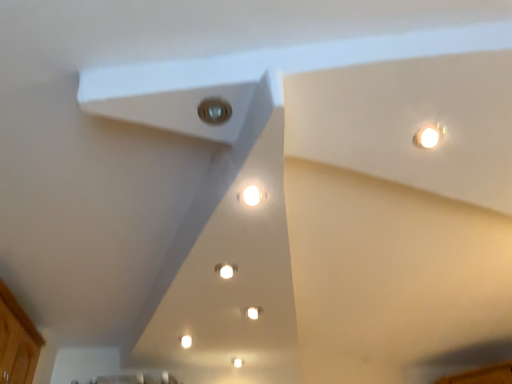
What do you see at coordinates (214, 111) in the screenshot? The image size is (512, 384). I see `matte glass light at center, which is the 2th light in back-to-front order` at bounding box center [214, 111].

This screenshot has width=512, height=384. Describe the element at coordinates (226, 271) in the screenshot. I see `white glossy light at center, placed as the 1th light when sorted from back to front` at that location.

Identify the location of matte glass light at center, which is the 1th light from top to bottom. (214, 111).

Between wooden cabinet at lower left and white glossy light at center, which appears as the first light when ordered from the bottom, which one appears on the left side from the viewer's perspective?

Positioned to the left is wooden cabinet at lower left.

Is the position of wooden cabinet at lower left more distant than that of white glossy light at center, the second light viewed from the top?

No, wooden cabinet at lower left is closer to the viewer.

Where is `the 1st light positioned above the wooden cabinet at lower left (from a real-world perspective)`? the 1st light positioned above the wooden cabinet at lower left (from a real-world perspective) is located at coordinates (226, 271).

Considering the sizes of wooden cabinet at lower left and white glossy light at center, placed as the 1th light when sorted from back to front, in the image, is wooden cabinet at lower left bigger or smaller than white glossy light at center, placed as the 1th light when sorted from back to front,?

wooden cabinet at lower left is bigger than white glossy light at center, placed as the 1th light when sorted from back to front.

Looking at this image, is white glossy light at center, which appears as the first light when ordered from the bottom, at the back of matte glass light at center, which is the 2th light from bottom to top?

That's not correct — matte glass light at center, which is the 2th light from bottom to top, is not looking away from white glossy light at center, which appears as the first light when ordered from the bottom.

Can you confirm if matte glass light at center, which is the 1th light from top to bottom, is wider than white glossy light at center, which appears as the first light when ordered from the bottom?

Correct, the width of matte glass light at center, which is the 1th light from top to bottom, exceeds that of white glossy light at center, which appears as the first light when ordered from the bottom.

How many degrees apart are the facing directions of matte glass light at center, arranged as the first light when viewed from the front, and white glossy light at center, which appears as the first light when ordered from the bottom?

99.3 degrees separate the facing orientations of matte glass light at center, arranged as the first light when viewed from the front, and white glossy light at center, which appears as the first light when ordered from the bottom.

Is the position of matte glass light at center, which is the 1th light from top to bottom, less distant than that of white glossy light at center, placed as the 1th light when sorted from back to front?

Yes, the depth of matte glass light at center, which is the 1th light from top to bottom, is less than that of white glossy light at center, placed as the 1th light when sorted from back to front.

Consider the image. Which object is more forward, wooden cabinet at lower left or matte glass light at center, which is the 2th light from bottom to top?

matte glass light at center, which is the 2th light from bottom to top, is more forward.

From a real-world perspective, between wooden cabinet at lower left and matte glass light at center, arranged as the first light when viewed from the front, who is vertically higher?

In real-world perspective, matte glass light at center, arranged as the first light when viewed from the front, is above.

Considering the sizes of wooden cabinet at lower left and matte glass light at center, which is the 2th light in back-to-front order, in the image, is wooden cabinet at lower left wider or thinner than matte glass light at center, which is the 2th light in back-to-front order,?

wooden cabinet at lower left is wider than matte glass light at center, which is the 2th light in back-to-front order.

From the image's perspective, would you say wooden cabinet at lower left is shown under matte glass light at center, which is the 1th light from top to bottom?

Yes, from the image's perspective, wooden cabinet at lower left is beneath matte glass light at center, which is the 1th light from top to bottom.

From a real-world perspective, relative to wooden cabinet at lower left, is matte glass light at center, which is the 1th light from top to bottom, vertically above or below?

From a real-world perspective, matte glass light at center, which is the 1th light from top to bottom, is physically above wooden cabinet at lower left.

Can we say matte glass light at center, which is the 1th light from top to bottom, lies outside wooden cabinet at lower left?

Yes, matte glass light at center, which is the 1th light from top to bottom, is outside of wooden cabinet at lower left.

Consider the image. Considering the sizes of objects matte glass light at center, which is the 2th light from bottom to top, and wooden cabinet at lower left in the image provided, who is smaller, matte glass light at center, which is the 2th light from bottom to top, or wooden cabinet at lower left?

With smaller size is matte glass light at center, which is the 2th light from bottom to top.

In the scene shown: Which of these two, matte glass light at center, which is the 1th light from top to bottom, or wooden cabinet at lower left, stands shorter?

matte glass light at center, which is the 1th light from top to bottom, is shorter.

Is white glossy light at center, the second light viewed from the top, to the right of wooden cabinet at lower left from the viewer's perspective?

Indeed, white glossy light at center, the second light viewed from the top, is positioned on the right side of wooden cabinet at lower left.

Does white glossy light at center, marked as the second light in a front-to-back arrangement, have a lesser width compared to wooden cabinet at lower left?

Yes, white glossy light at center, marked as the second light in a front-to-back arrangement, is thinner than wooden cabinet at lower left.

Are white glossy light at center, placed as the 1th light when sorted from back to front, and wooden cabinet at lower left located far from each other?

No, white glossy light at center, placed as the 1th light when sorted from back to front, is not far away from wooden cabinet at lower left.

Does point (227, 274) lie in front of point (218, 104)?

No, it is not.

Is white glossy light at center, the second light viewed from the top, wider or thinner than matte glass light at center, which is the 1th light from top to bottom?

Clearly, white glossy light at center, the second light viewed from the top, has less width compared to matte glass light at center, which is the 1th light from top to bottom.

Between white glossy light at center, placed as the 1th light when sorted from back to front, and matte glass light at center, which is the 2th light from bottom to top, which one has more height?

white glossy light at center, placed as the 1th light when sorted from back to front.

From a real-world perspective, which object stands above the other?

From a 3D spatial view, matte glass light at center, which is the 2th light in back-to-front order, is above.

Locate an element on the screen. This screenshot has height=384, width=512. cabinetry directly beneath the white glossy light at center, the second light viewed from the top (from a real-world perspective) is located at coordinates (17, 341).

The height and width of the screenshot is (384, 512). What are the coordinates of `light in front of the white glossy light at center, which appears as the first light when ordered from the bottom` in the screenshot? It's located at (214, 111).

Considering their positions, is white glossy light at center, which appears as the first light when ordered from the bottom, positioned further to matte glass light at center, which is the 2th light from bottom to top, than wooden cabinet at lower left?

wooden cabinet at lower left lies further to matte glass light at center, which is the 2th light from bottom to top, than the other object.

Which object lies nearer to the anchor point wooden cabinet at lower left, white glossy light at center, which appears as the first light when ordered from the bottom, or matte glass light at center, arranged as the first light when viewed from the front?

Among the two, white glossy light at center, which appears as the first light when ordered from the bottom, is located nearer to wooden cabinet at lower left.

Based on their spatial positions, is wooden cabinet at lower left or white glossy light at center, placed as the 1th light when sorted from back to front, closer to matte glass light at center, arranged as the first light when viewed from the front?

Based on the image, white glossy light at center, placed as the 1th light when sorted from back to front, appears to be nearer to matte glass light at center, arranged as the first light when viewed from the front.

Considering their positions, is matte glass light at center, which is the 2th light from bottom to top, positioned further to white glossy light at center, placed as the 1th light when sorted from back to front, than wooden cabinet at lower left?

wooden cabinet at lower left.

Based on their spatial positions, is matte glass light at center, which is the 2th light in back-to-front order, or white glossy light at center, placed as the 1th light when sorted from back to front, further from wooden cabinet at lower left?

The object further to wooden cabinet at lower left is matte glass light at center, which is the 2th light in back-to-front order.

From the image, which object appears to be nearer to white glossy light at center, placed as the 1th light when sorted from back to front, wooden cabinet at lower left or matte glass light at center, arranged as the first light when viewed from the front?

matte glass light at center, arranged as the first light when viewed from the front, is positioned closer to the anchor white glossy light at center, placed as the 1th light when sorted from back to front.

The image size is (512, 384). Identify the location of light between wooden cabinet at lower left and matte glass light at center, which is the 2th light in back-to-front order, from left to right. (226, 271).